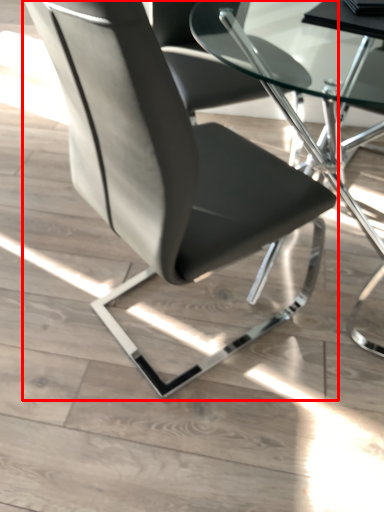
Question: From the image's perspective, considering the relative positions of chair (annotated by the red box) and table in the image provided, where is chair (annotated by the red box) located with respect to the staircase?

Choices:
 (A) below
 (B) above

Answer: (A)